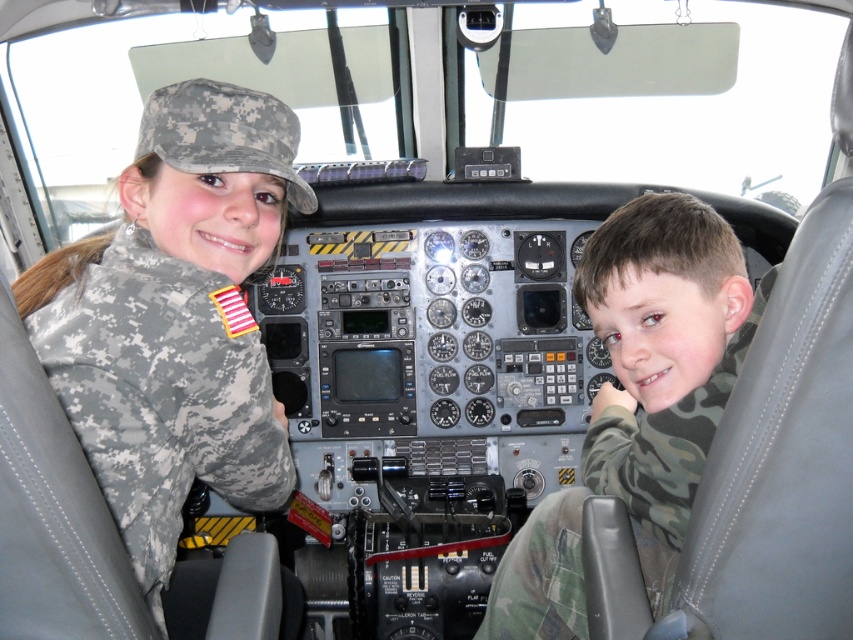
Question: Is the position of camouflage uniform at left less distant than that of camouflage fabric shirt at center?

Choices:
 (A) no
 (B) yes

Answer: (A)

Question: Which object is closer to the camera taking this photo?

Choices:
 (A) camouflage uniform at left
 (B) camouflage fabric shirt at center

Answer: (B)

Question: Can you confirm if camouflage uniform at left is positioned to the left of camouflage fabric shirt at center?

Choices:
 (A) no
 (B) yes

Answer: (B)

Question: Does camouflage uniform at left have a smaller size compared to camouflage fabric shirt at center?

Choices:
 (A) no
 (B) yes

Answer: (B)